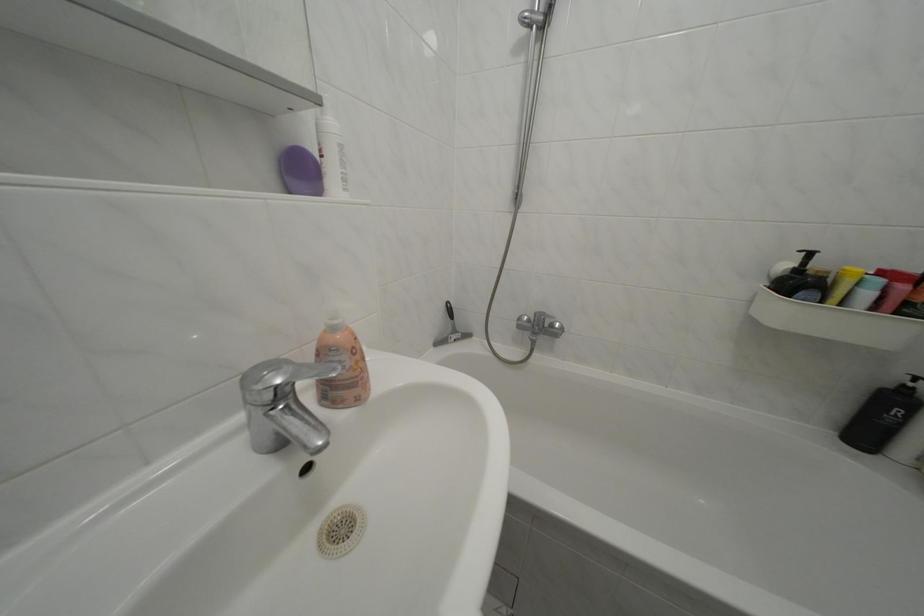
What do you see at coordinates (265, 382) in the screenshot?
I see `the faucet diverter knob` at bounding box center [265, 382].